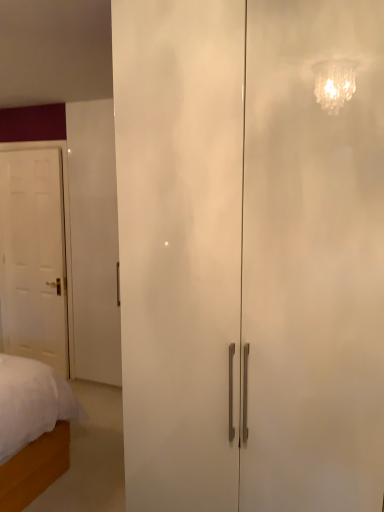
Locate an element on the screen. Image resolution: width=384 pixels, height=512 pixels. white matte door at left, which is counted as the first door, starting from the left is located at coordinates click(x=34, y=256).

Measure the distance between point (55, 266) and camera.

They are 3.64 meters apart.

What is the approximate height of white matte door at left, acting as the second door starting from the right?

The height of white matte door at left, acting as the second door starting from the right, is 6.36 feet.

Describe the element at coordinates (34, 256) in the screenshot. I see `white matte door at left, acting as the second door starting from the right` at that location.

The width and height of the screenshot is (384, 512). Describe the element at coordinates (250, 254) in the screenshot. I see `white glossy cabinet at center, which is the first door in right-to-left order` at that location.

Locate an element on the screen. white glossy cabinet at center, the first door when ordered from front to back is located at coordinates (250, 254).

This screenshot has height=512, width=384. I want to click on white matte door at left, the first door when ordered from back to front, so click(34, 256).

Which object is positioned more to the left, white matte door at left, acting as the second door starting from the right, or white glossy cabinet at center, which is the first door in right-to-left order?

Positioned to the left is white matte door at left, acting as the second door starting from the right.

In the image, is white matte door at left, acting as the second door starting from the right, positioned in front of or behind white glossy cabinet at center, which is the first door in right-to-left order?

Clearly, white matte door at left, acting as the second door starting from the right, is behind white glossy cabinet at center, which is the first door in right-to-left order.

Which point is more forward, [47,162] or [329,162]?

The point [329,162] is closer to the camera.

From the image's perspective, is white matte door at left, which is counted as the first door, starting from the left, above or below white glossy cabinet at center, the second door in the back-to-front sequence?

white matte door at left, which is counted as the first door, starting from the left, is above white glossy cabinet at center, the second door in the back-to-front sequence.

From a real-world perspective, which object stands above the other?

white glossy cabinet at center, the first door when ordered from front to back.

Considering the relative sizes of white matte door at left, marked as the 2th door in a front-to-back arrangement, and white glossy cabinet at center, the second door in the back-to-front sequence, in the image provided, is white matte door at left, marked as the 2th door in a front-to-back arrangement, wider than white glossy cabinet at center, the second door in the back-to-front sequence,?

No, white matte door at left, marked as the 2th door in a front-to-back arrangement, is not wider than white glossy cabinet at center, the second door in the back-to-front sequence.

Is white matte door at left, acting as the second door starting from the right, shorter than white glossy cabinet at center, the first door when ordered from front to back?

Correct, white matte door at left, acting as the second door starting from the right, is not as tall as white glossy cabinet at center, the first door when ordered from front to back.

Is white matte door at left, marked as the 2th door in a front-to-back arrangement, bigger than white glossy cabinet at center, the second door in the back-to-front sequence?

No, white matte door at left, marked as the 2th door in a front-to-back arrangement, is not bigger than white glossy cabinet at center, the second door in the back-to-front sequence.

Is white glossy cabinet at center, the first door when ordered from front to back, completely or partially inside white matte door at left, marked as the 2th door in a front-to-back arrangement?

Actually, white glossy cabinet at center, the first door when ordered from front to back, is outside white matte door at left, marked as the 2th door in a front-to-back arrangement.

Is the surface of white matte door at left, acting as the second door starting from the right, in direct contact with white glossy cabinet at center, the second door in the back-to-front sequence?

white matte door at left, acting as the second door starting from the right, is not next to white glossy cabinet at center, the second door in the back-to-front sequence, and they're not touching.

Is white matte door at left, the first door when ordered from back to front, looking in the opposite direction of white glossy cabinet at center, the second door in the back-to-front sequence?

No, white glossy cabinet at center, the second door in the back-to-front sequence, is not at the back of white matte door at left, the first door when ordered from back to front.

Where is `door that is on the left side of white glossy cabinet at center, the first door when ordered from front to back`? door that is on the left side of white glossy cabinet at center, the first door when ordered from front to back is located at coordinates (34, 256).

Considering the positions of objects white glossy cabinet at center, the second door in the back-to-front sequence, and white matte door at left, acting as the second door starting from the right, in the image provided, who is more to the right, white glossy cabinet at center, the second door in the back-to-front sequence, or white matte door at left, acting as the second door starting from the right,?

From the viewer's perspective, white glossy cabinet at center, the second door in the back-to-front sequence, appears more on the right side.

Is white glossy cabinet at center, the first door when ordered from front to back, positioned before white matte door at left, which is counted as the first door, starting from the left?

Yes.

Considering the positions of points (270, 31) and (59, 242), is point (270, 31) farther from camera compared to point (59, 242)?

No.

From the image's perspective, between white glossy cabinet at center, the first door when ordered from front to back, and white matte door at left, acting as the second door starting from the right, who is located below?

From the image's view, white glossy cabinet at center, the first door when ordered from front to back, is below.

From a real-world perspective, which object rests below the other?

white matte door at left, acting as the second door starting from the right, is physically lower.

Which of these two, white glossy cabinet at center, which is the first door in right-to-left order, or white matte door at left, the first door when ordered from back to front, is thinner?

With smaller width is white matte door at left, the first door when ordered from back to front.

Between white glossy cabinet at center, which is the first door in right-to-left order, and white matte door at left, which is counted as the first door, starting from the left, which one has more height?

Standing taller between the two is white glossy cabinet at center, which is the first door in right-to-left order.

Considering the sizes of white glossy cabinet at center, the second door from the left, and white matte door at left, acting as the second door starting from the right, in the image, is white glossy cabinet at center, the second door from the left, bigger or smaller than white matte door at left, acting as the second door starting from the right,?

white glossy cabinet at center, the second door from the left, is bigger than white matte door at left, acting as the second door starting from the right.

Which is correct: white glossy cabinet at center, which is the first door in right-to-left order, is inside white matte door at left, acting as the second door starting from the right, or outside of it?

white glossy cabinet at center, which is the first door in right-to-left order, is outside white matte door at left, acting as the second door starting from the right.

Are white glossy cabinet at center, the second door in the back-to-front sequence, and white matte door at left, the first door when ordered from back to front, beside each other?

No, white glossy cabinet at center, the second door in the back-to-front sequence, is not touching white matte door at left, the first door when ordered from back to front.

Is white glossy cabinet at center, the second door from the left, positioned with its back to white matte door at left, acting as the second door starting from the right?

No.

Measure the distance between white glossy cabinet at center, which is the first door in right-to-left order, and white matte door at left, marked as the 2th door in a front-to-back arrangement.

7.95 feet.

Find the location of a particular element. The image size is (384, 512). door that appears below the white glossy cabinet at center, the second door in the back-to-front sequence (from a real-world perspective) is located at coordinates (34, 256).

Locate an element on the screen. door below the white glossy cabinet at center, the second door in the back-to-front sequence (from a real-world perspective) is located at coordinates point(34,256).

Identify the location of door above the white glossy cabinet at center, the first door when ordered from front to back (from the image's perspective). The image size is (384, 512). (34, 256).